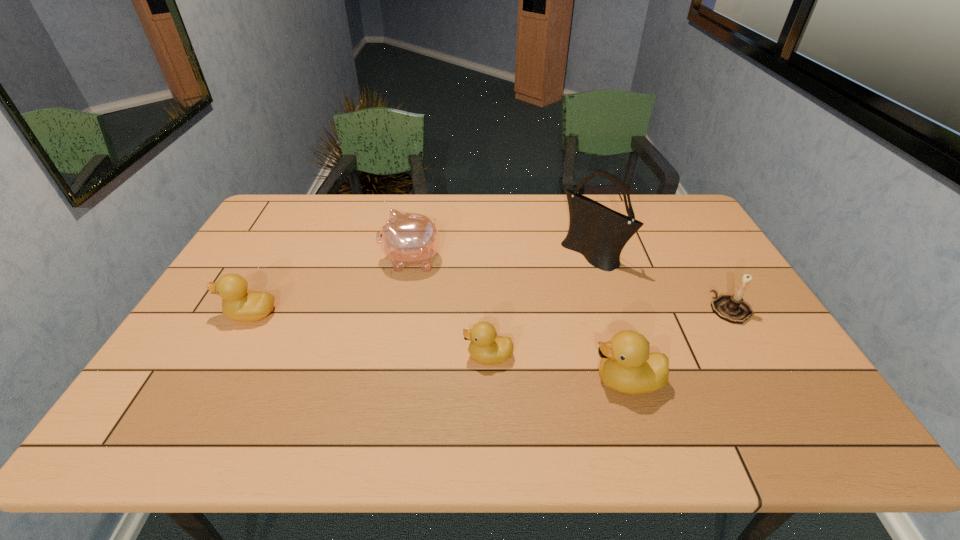
Where is `the second tallest duckling`? This screenshot has width=960, height=540. the second tallest duckling is located at coordinates (242, 305).

Where is `the farthest duckling`? the farthest duckling is located at coordinates (242, 305).

At what (x,y) coordinates should I click in order to perform the action: click on the shortest duckling. Please return your answer as a coordinate pair (x, y). Looking at the image, I should click on (486, 347).

I want to click on the second duckling from left to right, so click(x=486, y=347).

Image resolution: width=960 pixels, height=540 pixels. I want to click on the rightmost duckling, so click(x=627, y=367).

This screenshot has width=960, height=540. I want to click on the rightmost object, so click(733, 308).

You are a GUI agent. You are given a task and a screenshot of the screen. Output one action in this format:
    pyautogui.click(x=<x>, y=<y>)
    Task: Click on the piggy bank
    
    Given the screenshot: What is the action you would take?
    pyautogui.click(x=407, y=239)

I want to click on the tallest object, so click(x=599, y=233).

The height and width of the screenshot is (540, 960). What are the coordinates of `vacant space located on the face of the second shortest duckling` in the screenshot? It's located at (204, 314).

The height and width of the screenshot is (540, 960). What are the coordinates of `free space located on the face of the shortest duckling` in the screenshot? It's located at (444, 356).